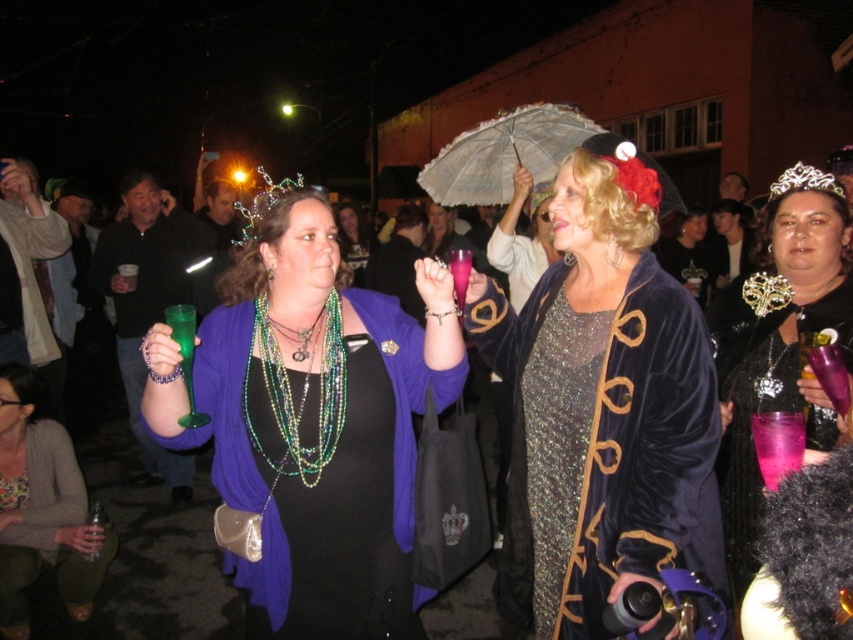
Is matte black dress at center further to camera compared to gold metallic tiara at upper right?

Yes, matte black dress at center is behind gold metallic tiara at upper right.

Which is behind, point (57, 460) or point (798, 173)?

The point (57, 460) is behind.

Who is more forward, (77, 509) or (807, 168)?

Positioned in front is point (807, 168).

Locate an element on the screen. matte black dress at center is located at coordinates (42, 508).

Looking at this image, is velvet dress at center bigger than matte green glass at center?

Incorrect, velvet dress at center is not larger than matte green glass at center.

The image size is (853, 640). What do you see at coordinates (601, 404) in the screenshot? I see `velvet dress at center` at bounding box center [601, 404].

Does point (605, 260) lie in front of point (358, 259)?

Yes, it is in front of point (358, 259).

The width and height of the screenshot is (853, 640). Find the location of `velvet dress at center`. velvet dress at center is located at coordinates coord(601,404).

Between point (79, 497) and point (497, 176), which one is positioned in front?

Positioned in front is point (79, 497).

Who is more distant from viewer, (x=56, y=528) or (x=524, y=141)?

The point (x=524, y=141) is behind.

From the picture: Who is more distant from viewer, (7, 378) or (489, 128)?

The point (7, 378) is more distant.

Find the location of a particular element. Image resolution: width=853 pixels, height=640 pixels. matte black dress at center is located at coordinates (42, 508).